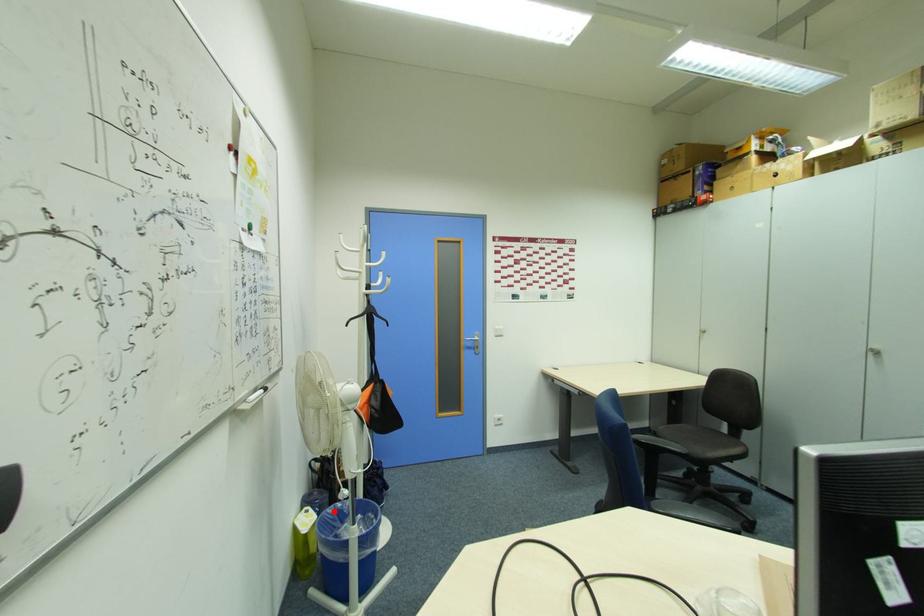
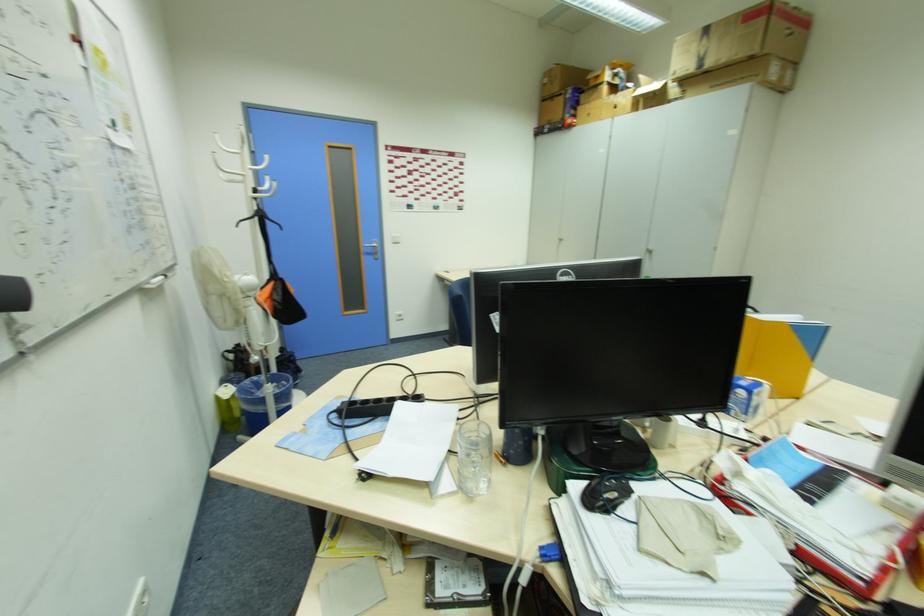
Question: I am providing you with two images of the same scene from different viewpoints. Given a red point in image1, look at the same physical point in image2. Is it:

Choices:
 (A) Closer to the viewpoint
 (B) Farther from the viewpoint

Answer: (A)